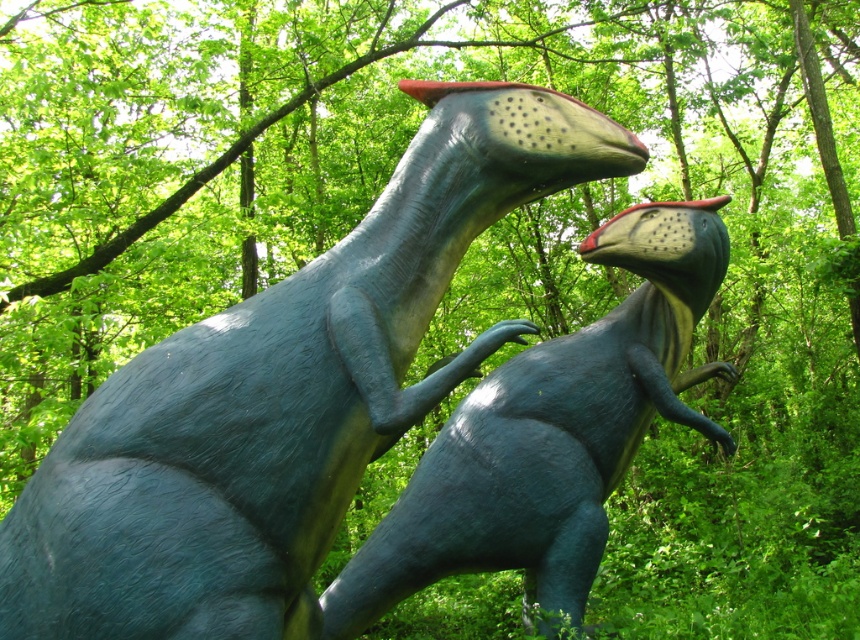
Question: Does matte blue dinosaur at center lie in front of shiny blue dinosaur at center?

Choices:
 (A) yes
 (B) no

Answer: (A)

Question: Which of the following is the farthest from the observer?

Choices:
 (A) matte blue dinosaur at center
 (B) shiny blue dinosaur at center

Answer: (B)

Question: Is matte blue dinosaur at center positioned behind shiny blue dinosaur at center?

Choices:
 (A) yes
 (B) no

Answer: (B)

Question: Among these points, which one is farthest from the camera?

Choices:
 (A) (367, 593)
 (B) (551, 154)

Answer: (A)

Question: Does matte blue dinosaur at center appear on the left side of shiny blue dinosaur at center?

Choices:
 (A) yes
 (B) no

Answer: (A)